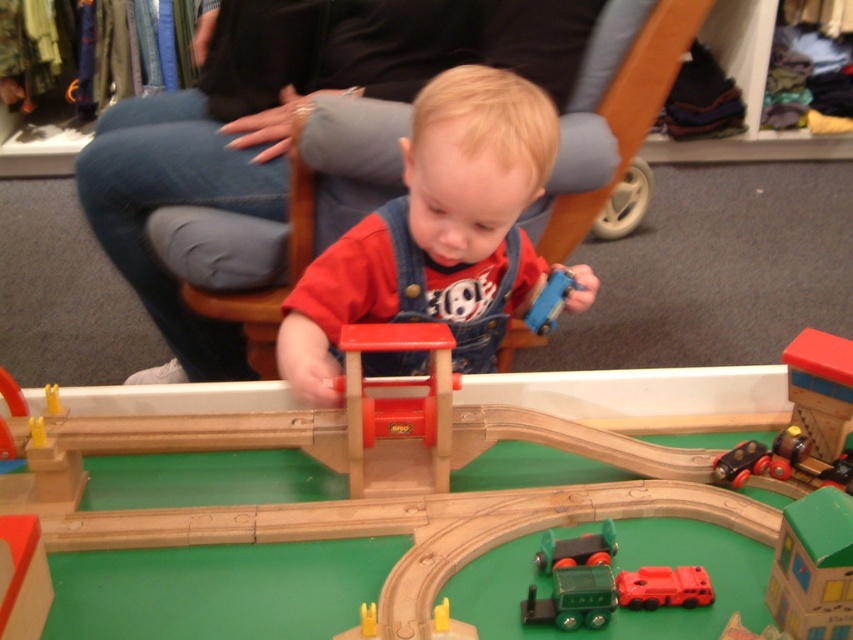
How much distance is there between wooden bridge at center and wooden train station at center?

wooden bridge at center is 4.96 inches from wooden train station at center.

Based on the photo, is wooden bridge at center further to the viewer compared to wooden train station at center?

No, it is in front of wooden train station at center.

You are a GUI agent. You are given a task and a screenshot of the screen. Output one action in this format:
    pyautogui.click(x=<x>, y=<y>)
    Task: Click on the wooden bridge at center
    The height and width of the screenshot is (640, 853).
    Given the screenshot: What is the action you would take?
    pyautogui.click(x=376, y=483)

Where is `wooden bridge at center`? wooden bridge at center is located at coordinates (376, 483).

Does wooden bridge at center have a smaller size compared to green matte train at center?

No, wooden bridge at center is not smaller than green matte train at center.

Can you confirm if wooden bridge at center is positioned above green matte train at center?

Correct, wooden bridge at center is located above green matte train at center.

At what (x,y) coordinates should I click in order to perform the action: click on wooden bridge at center. Please return your answer as a coordinate pair (x, y). Looking at the image, I should click on (376, 483).

You are a GUI agent. You are given a task and a screenshot of the screen. Output one action in this format:
    pyautogui.click(x=<x>, y=<y>)
    Task: Click on the wooden bridge at center
    This screenshot has width=853, height=640.
    Given the screenshot: What is the action you would take?
    pyautogui.click(x=376, y=483)

Between green matte train at center and metallic black train at lower right, which one has less height?

Standing shorter between the two is metallic black train at lower right.

Is green matte train at center taller than metallic black train at lower right?

Yes, green matte train at center is taller than metallic black train at lower right.

This screenshot has height=640, width=853. In order to click on green matte train at center in this screenshot , I will do `click(577, 548)`.